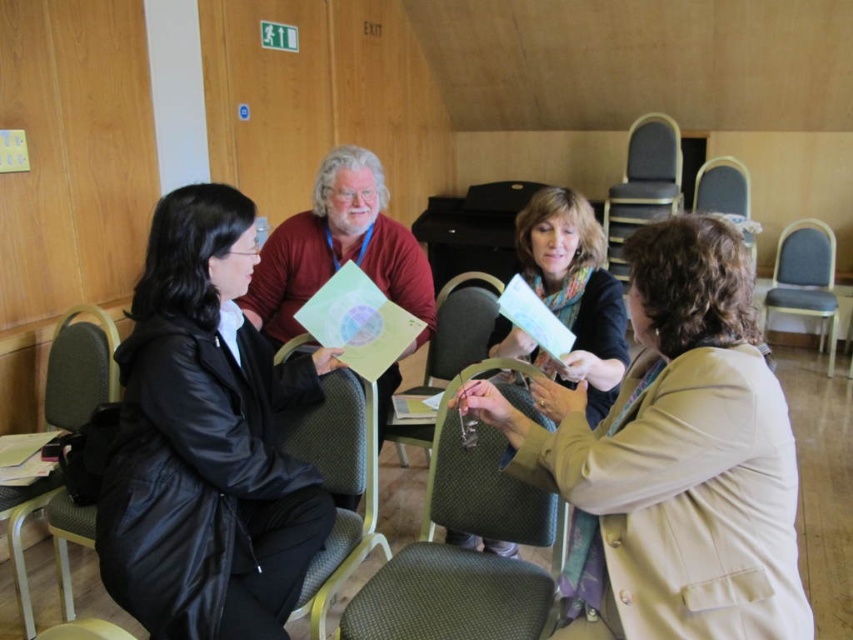
Between black leather jacket at left and textured fabric chair at center, which one has less height?

Standing shorter between the two is textured fabric chair at center.

Does black leather jacket at left appear over textured fabric chair at center?

No.

This screenshot has width=853, height=640. Find the location of `black leather jacket at left`. black leather jacket at left is located at coordinates (206, 440).

Is green fabric chair at center above textured fabric chair at center?

Incorrect, green fabric chair at center is not positioned above textured fabric chair at center.

Which is behind, point (415, 589) or point (457, 364)?

The point (457, 364) is more distant.

I want to click on green fabric chair at center, so click(x=450, y=596).

How much distance is there between green fabric chair at lower center and matte gray chair at right?

green fabric chair at lower center is 3.17 meters away from matte gray chair at right.

Is point (361, 420) positioned after point (717, 161)?

That is False.

Is point (340, 419) positioned before point (717, 204)?

Yes, point (340, 419) is in front of point (717, 204).

Image resolution: width=853 pixels, height=640 pixels. I want to click on green fabric chair at lower center, so click(x=339, y=484).